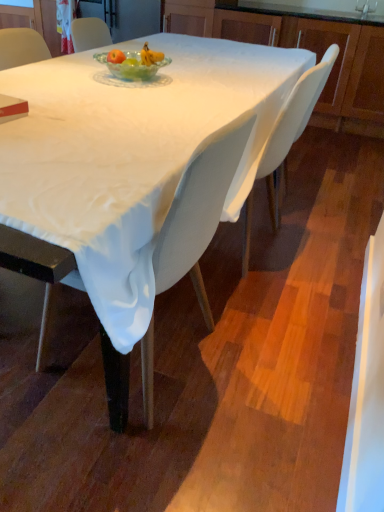
Question: Considering the positions of silver metallic faucet at upper center and matte wood cabinet at upper right in the image, is silver metallic faucet at upper center bigger or smaller than matte wood cabinet at upper right?

Choices:
 (A) big
 (B) small

Answer: (B)

Question: Considering the positions of point (360, 10) and point (279, 23), is point (360, 10) closer or farther from the camera than point (279, 23)?

Choices:
 (A) closer
 (B) farther

Answer: (B)

Question: Estimate the real-world distances between objects in this image. Which object is farther from the white plastic chair at center, the second chair when ordered from front to back?

Choices:
 (A) translucent glass bowl at center
 (B) matte red book at lower left
 (C) white fabric table at center
 (D) matte wood cabinet at upper right
 (E) white fabric chair at center, which is the 2th chair in back-to-front order

Answer: (D)

Question: Considering the real-world distances, which object is farthest from the white plastic chair at center, which ranks as the second chair in left-to-right order?

Choices:
 (A) white fabric chair at center, placed as the second chair when sorted from right to left
 (B) silver metallic faucet at upper center
 (C) white fabric table at center
 (D) translucent glass bowl at center
 (E) matte red book at lower left

Answer: (B)